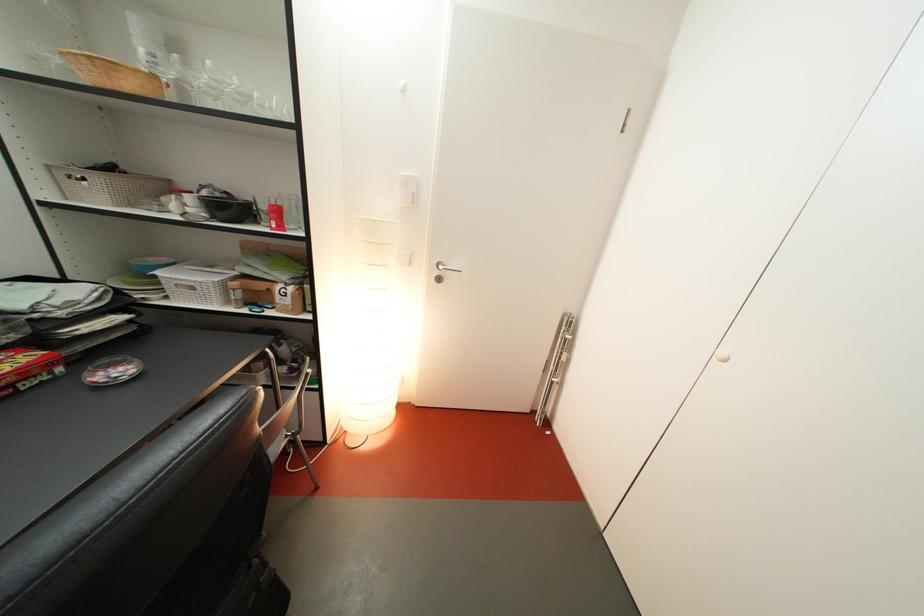
Where would you pull the white cabinet knob? Please return your answer as a coordinate pair (x, y).

(721, 355)